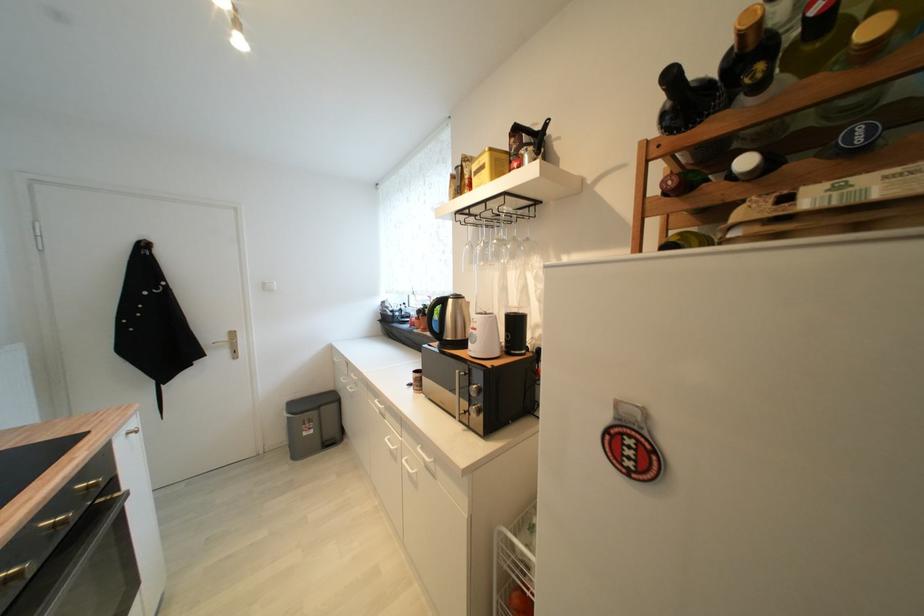
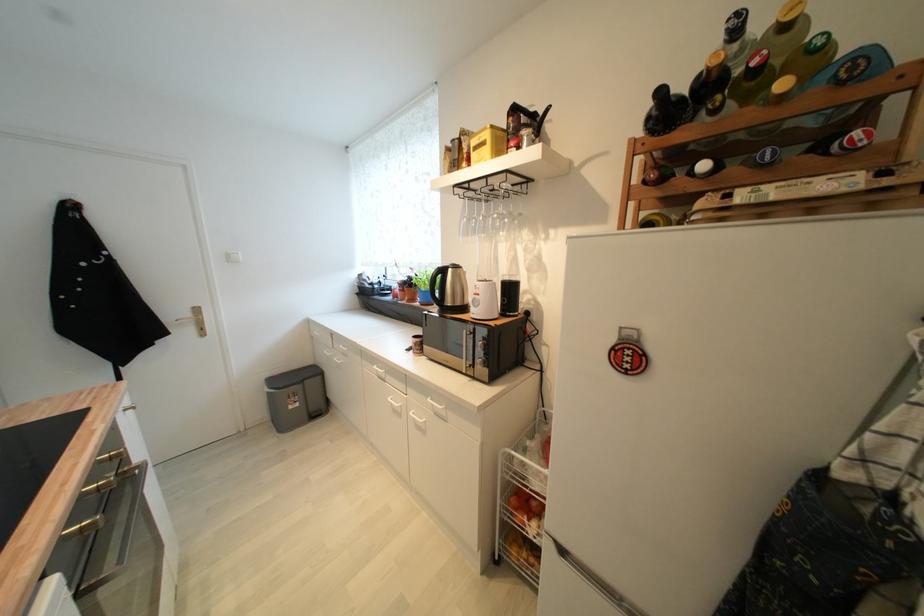
Locate, in the second image, the point that corresponds to [517,142] in the first image.

(516, 121)